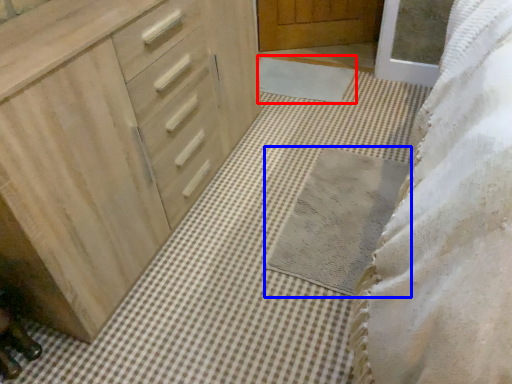
Question: Which of the following is the closest to the observer, bath mat (highlighted by a red box) or bath mat (highlighted by a blue box)?

Choices:
 (A) bath mat
 (B) bath mat

Answer: (B)